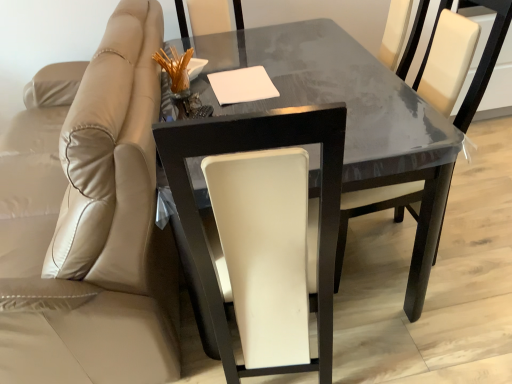
Question: Is beige leather chair at left, which is counted as the 1th chair, starting from the left, turned away from glossy dark wood table at center?

Choices:
 (A) yes
 (B) no

Answer: (A)

Question: Is the depth of beige leather chair at left, which appears as the third chair when viewed from the right, less than that of glossy dark wood table at center?

Choices:
 (A) no
 (B) yes

Answer: (B)

Question: Is beige leather chair at left, which is counted as the 1th chair, starting from the left, to the right of glossy dark wood table at center from the viewer's perspective?

Choices:
 (A) no
 (B) yes

Answer: (A)

Question: From the image's perspective, is beige leather chair at left, which appears as the third chair when viewed from the right, beneath glossy dark wood table at center?

Choices:
 (A) no
 (B) yes

Answer: (A)

Question: Can you confirm if beige leather chair at left, which is counted as the 1th chair, starting from the left, is taller than glossy dark wood table at center?

Choices:
 (A) yes
 (B) no

Answer: (A)

Question: In terms of width, does beige leather chair at left, which is counted as the 1th chair, starting from the left, look wider or thinner when compared to white leather chair at center, which ranks as the second chair in right-to-left order?

Choices:
 (A) thin
 (B) wide

Answer: (B)

Question: From a real-world perspective, is beige leather chair at left, which is counted as the 1th chair, starting from the left, above or below white leather chair at center, which ranks as the second chair in right-to-left order?

Choices:
 (A) below
 (B) above

Answer: (A)

Question: Considering their positions, is beige leather chair at left, which is counted as the 1th chair, starting from the left, located in front of or behind white leather chair at center, placed as the 2th chair when sorted from left to right?

Choices:
 (A) front
 (B) behind

Answer: (A)

Question: Which is correct: beige leather chair at left, which appears as the third chair when viewed from the right, is inside white leather chair at center, which ranks as the second chair in right-to-left order, or outside of it?

Choices:
 (A) outside
 (B) inside

Answer: (A)

Question: From the image's perspective, is glossy dark wood table at center positioned above or below beige leather chair at left, which appears as the third chair when viewed from the right?

Choices:
 (A) above
 (B) below

Answer: (B)

Question: Relative to beige leather chair at left, which is counted as the 1th chair, starting from the left, is glossy dark wood table at center in front or behind?

Choices:
 (A) front
 (B) behind

Answer: (B)

Question: Is point (198, 180) closer or farther from the camera than point (156, 87)?

Choices:
 (A) farther
 (B) closer

Answer: (B)

Question: From a real-world perspective, is glossy dark wood table at center above or below beige leather chair at left, which is counted as the 1th chair, starting from the left?

Choices:
 (A) above
 (B) below

Answer: (B)

Question: From a real-world perspective, is white leather chair at center, the third chair when ordered from left to right, physically located above or below white leather chair at center, which ranks as the second chair in right-to-left order?

Choices:
 (A) above
 (B) below

Answer: (B)

Question: From the image's perspective, is white leather chair at center, the third chair when ordered from left to right, above or below white leather chair at center, placed as the 2th chair when sorted from left to right?

Choices:
 (A) above
 (B) below

Answer: (B)